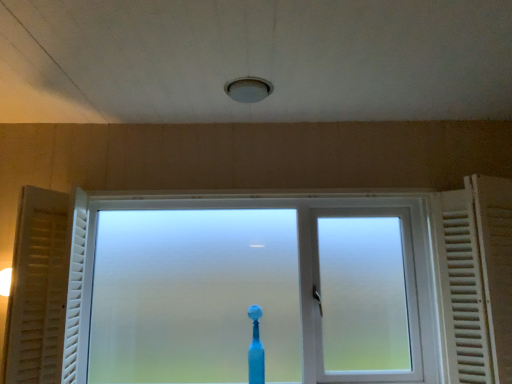
Question: From the image's perspective, would you say white wooden radiator at right is shown under frosted glass window at center?

Choices:
 (A) no
 (B) yes

Answer: (A)

Question: Is white wooden radiator at right positioned beyond the bounds of frosted glass window at center?

Choices:
 (A) no
 (B) yes

Answer: (B)

Question: Does white wooden radiator at right have a larger size compared to frosted glass window at center?

Choices:
 (A) no
 (B) yes

Answer: (A)

Question: Is white wooden radiator at right in contact with frosted glass window at center?

Choices:
 (A) yes
 (B) no

Answer: (B)

Question: Is white wooden radiator at right oriented away from frosted glass window at center?

Choices:
 (A) yes
 (B) no

Answer: (B)

Question: Considering the positions of blue plastic toothbrush at center and white matte curtain at left in the image, is blue plastic toothbrush at center taller or shorter than white matte curtain at left?

Choices:
 (A) short
 (B) tall

Answer: (A)

Question: Would you say blue plastic toothbrush at center is inside or outside white matte curtain at left?

Choices:
 (A) inside
 (B) outside

Answer: (B)

Question: Is point (260, 340) closer or farther from the camera than point (39, 251)?

Choices:
 (A) closer
 (B) farther

Answer: (B)

Question: From a real-world perspective, is blue plastic toothbrush at center above or below white matte curtain at left?

Choices:
 (A) below
 (B) above

Answer: (A)

Question: Is white matte curtain at left taller or shorter than blue plastic toothbrush at center?

Choices:
 (A) tall
 (B) short

Answer: (A)

Question: Is white matte curtain at left inside the boundaries of blue plastic toothbrush at center, or outside?

Choices:
 (A) inside
 (B) outside

Answer: (B)

Question: Does point (41, 283) appear closer or farther from the camera than point (259, 311)?

Choices:
 (A) closer
 (B) farther

Answer: (A)

Question: From a real-world perspective, relative to blue plastic toothbrush at center, is white matte curtain at left vertically above or below?

Choices:
 (A) above
 (B) below

Answer: (A)

Question: Based on their sizes in the image, would you say frosted glass window at center is bigger or smaller than blue plastic toothbrush at center?

Choices:
 (A) big
 (B) small

Answer: (A)

Question: Would you say frosted glass window at center is to the left or to the right of blue plastic toothbrush at center in the picture?

Choices:
 (A) left
 (B) right

Answer: (A)